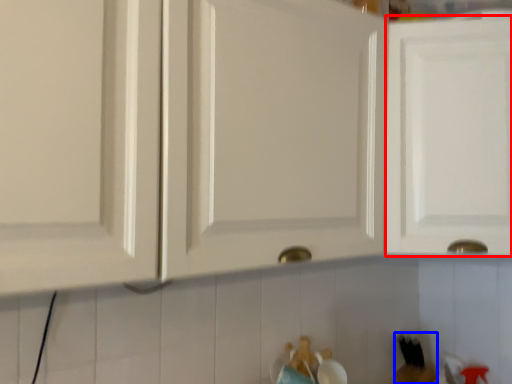
Question: Which object appears closest to the camera in this image, cabinetry (highlighted by a red box) or toy (highlighted by a blue box)?

Choices:
 (A) cabinetry
 (B) toy

Answer: (A)